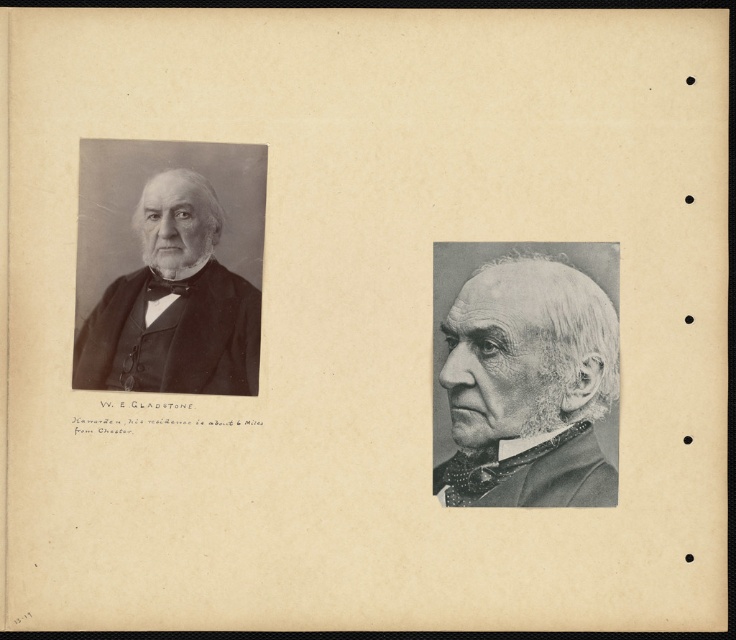
Based on the scene description, which object is positioned lower on the page between the gray matte suit at center and the matte black bow tie at left?

The gray matte suit at center is positioned lower on the page than the matte black bow tie at left.

What is the spatial relationship between the gray matte suit at center and the matte black bow tie at left in the portrait on the left side of the page?

The gray matte suit at center is in front of the matte black bow tie at left.